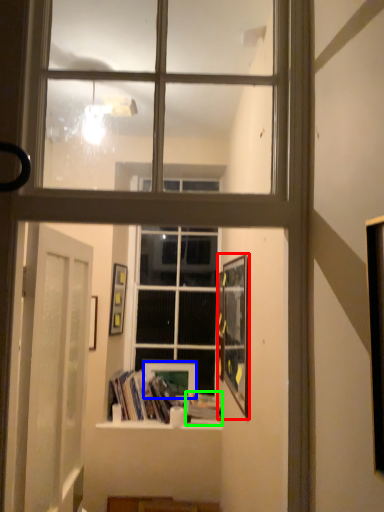
Question: Which object is the closest to the picture frame (highlighted by a red box)? Choose among these: picture frame (highlighted by a blue box) or paperback book (highlighted by a green box).

Choices:
 (A) picture frame
 (B) paperback book

Answer: (B)